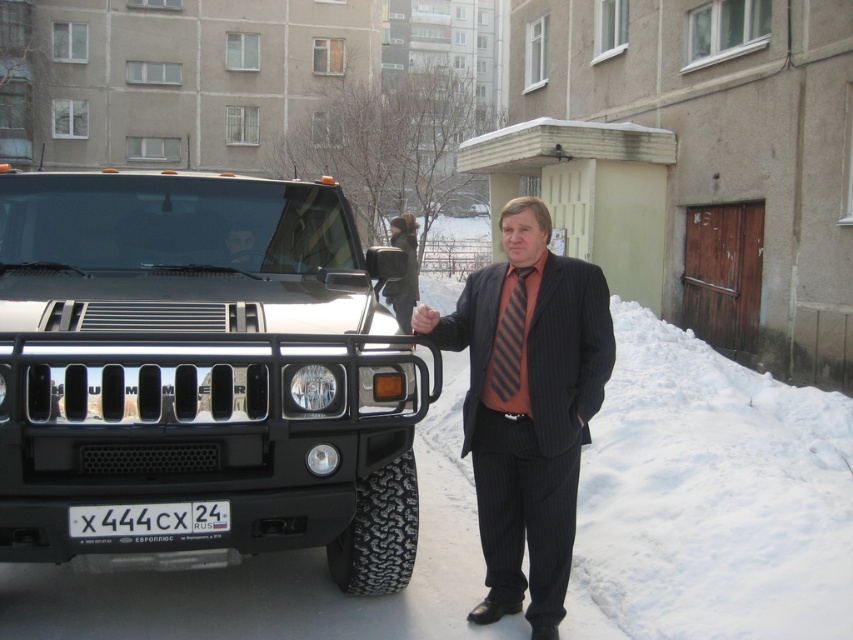
Does white plastic license plate at center appear on the right side of matte black hand at center?

In fact, white plastic license plate at center is to the left of matte black hand at center.

Which is above, white plastic license plate at center or matte black hand at center?

matte black hand at center is above.

Locate an element on the screen. The width and height of the screenshot is (853, 640). white plastic license plate at center is located at coordinates (149, 518).

This screenshot has height=640, width=853. What are the coordinates of `white plastic license plate at center` in the screenshot? It's located at (149, 518).

Which is behind, point (514, 401) or point (518, 340)?

The point (514, 401) is more distant.

Can you confirm if striped tie at center is positioned to the right of striped fabric tie at center?

Incorrect, striped tie at center is not on the right side of striped fabric tie at center.

Who is more forward, [500,499] or [521,339]?

Positioned in front is point [521,339].

Find the location of a particular element. The width and height of the screenshot is (853, 640). striped tie at center is located at coordinates (529, 406).

Can you confirm if striped tie at center is positioned below white plastic license plate at center?

No, striped tie at center is not below white plastic license plate at center.

Between point (514, 291) and point (97, 516), which one is positioned in front?

Point (97, 516) is in front.

Which is behind, point (595, 358) or point (225, 520)?

The point (595, 358) is behind.

The width and height of the screenshot is (853, 640). I want to click on striped tie at center, so click(x=529, y=406).